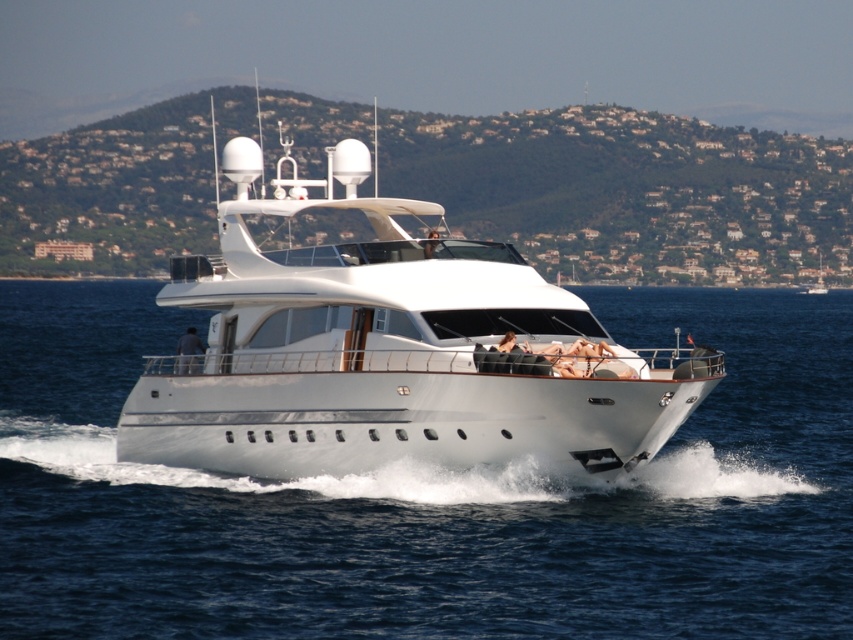
Based on the photo, you are a passenger on the white motor yacht and want to take a photo of the white glossy water at center. Where should you position yourself on the deck to capture it in the frame?

The white glossy water at center is located at point coordinates (431, 499), so you should position yourself near the center of the deck towards the back to capture it in the frame.

You are a passenger on the yacht and want to move from the back of the yacht to the front. You see two points marked on the deck. Which point should you head towards if you want to move forward? The points are point [732,598] and point [483,305].

Point [732,598] is in front of point [483,305], so you should head towards point [732,598] to move forward.

You are a passenger on the white glossy yacht at center. You want to jump into the water. Is the white glossy water at center accessible from your current position?

The white glossy water at center is positioned under white glossy yacht at center, so yes, the water is directly below the yacht, making it accessible for jumping in.